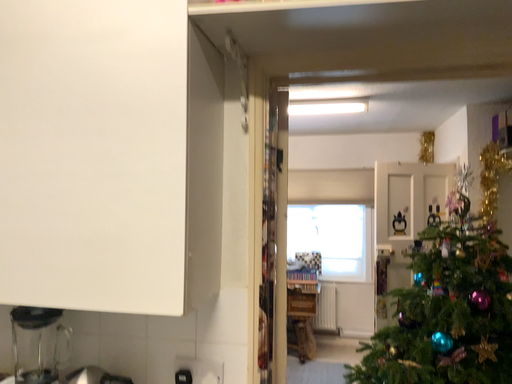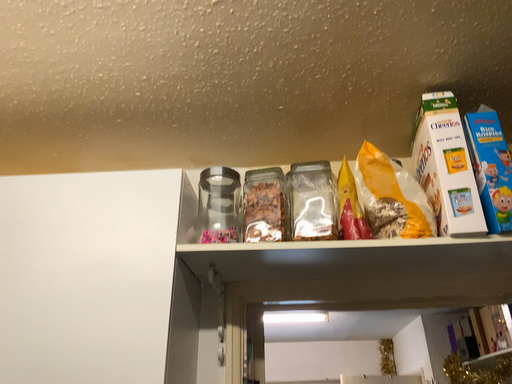
Question: How did the camera likely rotate when shooting the video?

Choices:
 (A) rotated downward
 (B) rotated upward

Answer: (B)